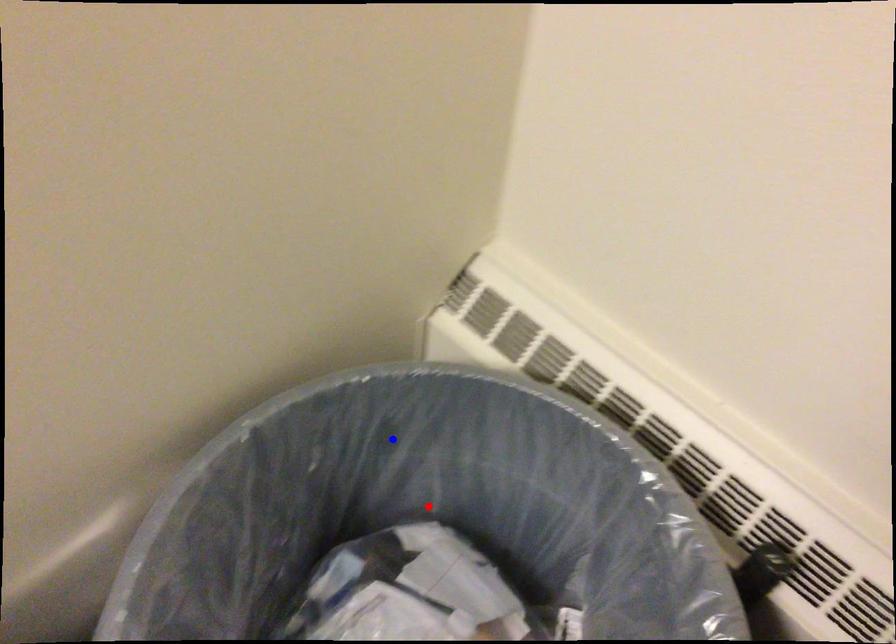
Question: Which of the two points in the image is closer to the camera?

Choices:
 (A) Blue point is closer.
 (B) Red point is closer.

Answer: (A)